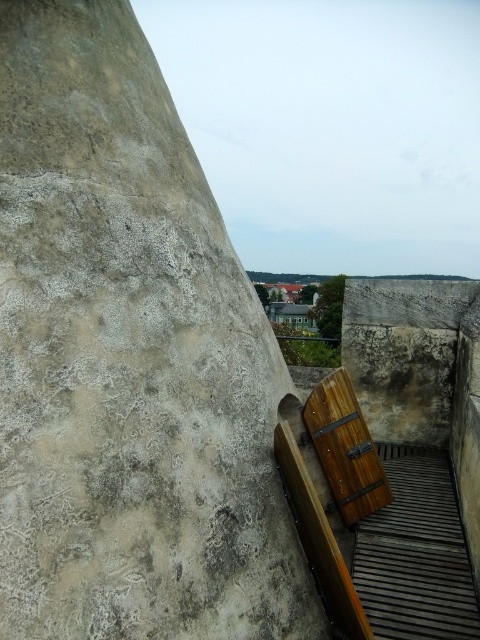
Question: Which of the following is the farthest from the observer?

Choices:
 (A) gray rough concrete at upper left
 (B) wooden at right

Answer: (B)

Question: Can you confirm if gray rough concrete at upper left is positioned to the left of wooden at right?

Choices:
 (A) yes
 (B) no

Answer: (A)

Question: Is gray rough concrete at upper left thinner than wooden at right?

Choices:
 (A) no
 (B) yes

Answer: (A)

Question: Can you confirm if gray rough concrete at upper left is positioned to the right of wooden at right?

Choices:
 (A) yes
 (B) no

Answer: (B)